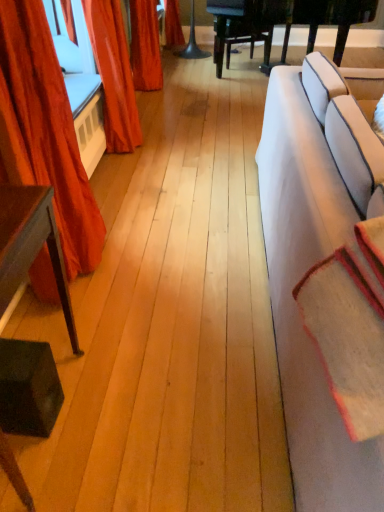
You are a GUI agent. You are given a task and a screenshot of the screen. Output one action in this format:
    pyautogui.click(x=<x>, y=<y>)
    Task: Click on the white fabric couch at right
    Image resolution: width=384 pixels, height=512 pixels.
    Given the screenshot: What is the action you would take?
    [x=295, y=303]

This screenshot has height=512, width=384. Describe the element at coordinates (47, 131) in the screenshot. I see `velvet red curtain at left, acting as the 2th curtain starting from the back` at that location.

In order to click on velvet orange curtain at upper left, positioned as the second curtain in front-to-back order in this screenshot , I will do `click(114, 74)`.

How much space does velvet orange curtain at upper left, positioned as the second curtain in front-to-back order, occupy vertically?

The height of velvet orange curtain at upper left, positioned as the second curtain in front-to-back order, is 3.28 feet.

At what (x,y) coordinates should I click in order to perform the action: click on white fabric couch at right. Please return your answer as a coordinate pair (x, y). Looking at the image, I should click on (295, 303).

Would you say white fabric couch at right contains dark brown wood table at left?

No, dark brown wood table at left is not a part of white fabric couch at right.

Would you say white fabric couch at right is a long distance from dark brown wood table at left?

They are positioned close to each other.

Considering the relative sizes of white fabric couch at right and dark brown wood table at left in the image provided, is white fabric couch at right shorter than dark brown wood table at left?

Incorrect, the height of white fabric couch at right does not fall short of that of dark brown wood table at left.

Is white fabric couch at right oriented towards dark brown wood table at left?

No, white fabric couch at right is not oriented towards dark brown wood table at left.

Consider the image. From the image's perspective, who appears lower, beige woolen blanket at right or white fabric couch at right?

beige woolen blanket at right.

Which of these two, beige woolen blanket at right or white fabric couch at right, is bigger?

white fabric couch at right is bigger.

Is beige woolen blanket at right placed right next to white fabric couch at right?

No, beige woolen blanket at right is not in contact with white fabric couch at right.

Can white fabric couch at right be found inside beige woolen blanket at right?

No.

Is velvet red curtain at left, acting as the 2th curtain starting from the back, inside the boundaries of velvet orange curtain at upper left, positioned as the second curtain in front-to-back order, or outside?

velvet red curtain at left, acting as the 2th curtain starting from the back, is not inside velvet orange curtain at upper left, positioned as the second curtain in front-to-back order, it's outside.

Is velvet red curtain at left, acting as the 2th curtain starting from the back, turned away from velvet orange curtain at upper left, positioned as the second curtain in front-to-back order?

That's not correct — velvet red curtain at left, acting as the 2th curtain starting from the back, is not looking away from velvet orange curtain at upper left, positioned as the second curtain in front-to-back order.

From the image's perspective, would you say velvet red curtain at left, acting as the 2th curtain starting from the back, is shown under velvet orange curtain at upper left, positioned as the second curtain in front-to-back order?

Yes.

From their relative heights in the image, would you say velvet red curtain at left, acting as the 2th curtain starting from the back, is taller or shorter than velvet orange curtain at upper left, positioned as the second curtain in front-to-back order?

Clearly, velvet red curtain at left, acting as the 2th curtain starting from the back, is taller compared to velvet orange curtain at upper left, positioned as the second curtain in front-to-back order.

Does point (72, 245) lie in front of point (6, 222)?

No, (72, 245) is behind (6, 222).

Identify the location of table lying in front of the velvet red curtain at left, the 1th curtain viewed from the front. (31, 245).

Are velvet red curtain at left, the 1th curtain viewed from the front, and dark brown wood table at left beside each other?

They are not placed beside each other.

Is velvet red curtain at left, the 1th curtain viewed from the front, located outside dark brown wood table at left?

Absolutely, velvet red curtain at left, the 1th curtain viewed from the front, is external to dark brown wood table at left.

Looking at this image, is white fabric couch at right situated inside beige woolen blanket at right or outside?

white fabric couch at right is not enclosed by beige woolen blanket at right.

How distant is white fabric couch at right from beige woolen blanket at right?

They are 10.94 inches apart.

Can you confirm if white fabric couch at right is taller than beige woolen blanket at right?

Yes, white fabric couch at right is taller than beige woolen blanket at right.

Which object is more forward, white fabric couch at right or beige woolen blanket at right?

white fabric couch at right.

Is dark brown wood table at left outside of beige woolen blanket at right?

Yes, dark brown wood table at left is located beyond the bounds of beige woolen blanket at right.

Does point (0, 450) lie behind point (382, 302)?

Yes, point (0, 450) is farther from viewer.

Between dark brown wood table at left and beige woolen blanket at right, which one has more height?

dark brown wood table at left is taller.

Between velvet red curtain at left, acting as the 2th curtain starting from the back, and beige woolen blanket at right, which one has more height?

Standing taller between the two is velvet red curtain at left, acting as the 2th curtain starting from the back.

Between velvet red curtain at left, acting as the 2th curtain starting from the back, and beige woolen blanket at right, which one has smaller width?

Thinner between the two is beige woolen blanket at right.

From a real-world perspective, is velvet red curtain at left, the 1th curtain viewed from the front, positioned over beige woolen blanket at right based on gravity?

No, from a real-world perspective, velvet red curtain at left, the 1th curtain viewed from the front, is not above beige woolen blanket at right.

The image size is (384, 512). I want to click on blanket below the velvet red curtain at left, acting as the 2th curtain starting from the back (from the image's perspective), so click(x=350, y=326).

There is a dark brown wood table at left. Identify the location of studio couch above it (from a real-world perspective). The image size is (384, 512). (295, 303).

You are a GUI agent. You are given a task and a screenshot of the screen. Output one action in this format:
    pyautogui.click(x=<x>, y=<y>)
    Task: Click on the blanket that is below the white fabric couch at right (from the image's perspective)
    This screenshot has height=512, width=384.
    Given the screenshot: What is the action you would take?
    pyautogui.click(x=350, y=326)

From the image, which object appears to be nearer to beige woolen blanket at right, white fabric couch at right or dark brown wood table at left?

white fabric couch at right is positioned closer to the anchor beige woolen blanket at right.

Which object lies further to the anchor point dark brown wood table at left, white fabric couch at right or beige woolen blanket at right?

white fabric couch at right.

When comparing their distances from velvet orange curtain at upper left, which appears as the first curtain when viewed from the back, does beige woolen blanket at right or white fabric couch at right seem closer?

Among the two, white fabric couch at right is located nearer to velvet orange curtain at upper left, which appears as the first curtain when viewed from the back.

When comparing their distances from velvet red curtain at left, acting as the 2th curtain starting from the back, does dark brown wood table at left or velvet orange curtain at upper left, which appears as the first curtain when viewed from the back, seem closer?

Among the two, dark brown wood table at left is located nearer to velvet red curtain at left, acting as the 2th curtain starting from the back.

In the scene shown: From the image, which object appears to be farther from velvet orange curtain at upper left, which appears as the first curtain when viewed from the back, beige woolen blanket at right or dark brown wood table at left?

The object further to velvet orange curtain at upper left, which appears as the first curtain when viewed from the back, is beige woolen blanket at right.

Estimate the real-world distances between objects in this image. Which object is further from dark brown wood table at left, velvet red curtain at left, the 1th curtain viewed from the front, or white fabric couch at right?

white fabric couch at right.

Based on their spatial positions, is velvet red curtain at left, the 1th curtain viewed from the front, or beige woolen blanket at right closer to white fabric couch at right?

The object closer to white fabric couch at right is beige woolen blanket at right.

From the picture: When comparing their distances from white fabric couch at right, does beige woolen blanket at right or velvet red curtain at left, acting as the 2th curtain starting from the back, seem closer?

beige woolen blanket at right lies closer to white fabric couch at right than the other object.

The height and width of the screenshot is (512, 384). I want to click on blanket between white fabric couch at right and velvet orange curtain at upper left, which appears as the first curtain when viewed from the back, along the z-axis, so click(350, 326).

Locate an element on the screen. The image size is (384, 512). blanket between dark brown wood table at left and white fabric couch at right is located at coordinates (350, 326).

Find the location of a particular element. table located between white fabric couch at right and velvet orange curtain at upper left, positioned as the second curtain in front-to-back order, in the depth direction is located at coordinates (31, 245).

Locate an element on the screen. Image resolution: width=384 pixels, height=512 pixels. table between beige woolen blanket at right and velvet orange curtain at upper left, which appears as the first curtain when viewed from the back, in the front-back direction is located at coordinates [31, 245].